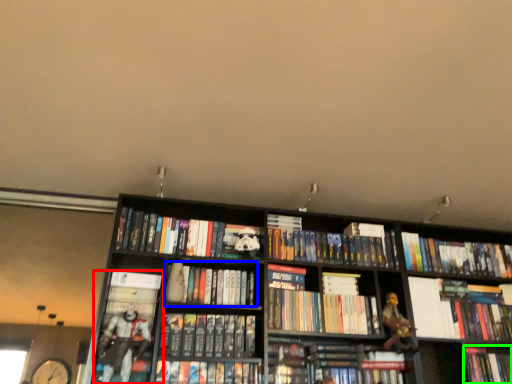
Question: Which object is the farthest from book (highlighted by a red box)? Choose among these: book (highlighted by a blue box) or book (highlighted by a green box).

Choices:
 (A) book
 (B) book

Answer: (B)